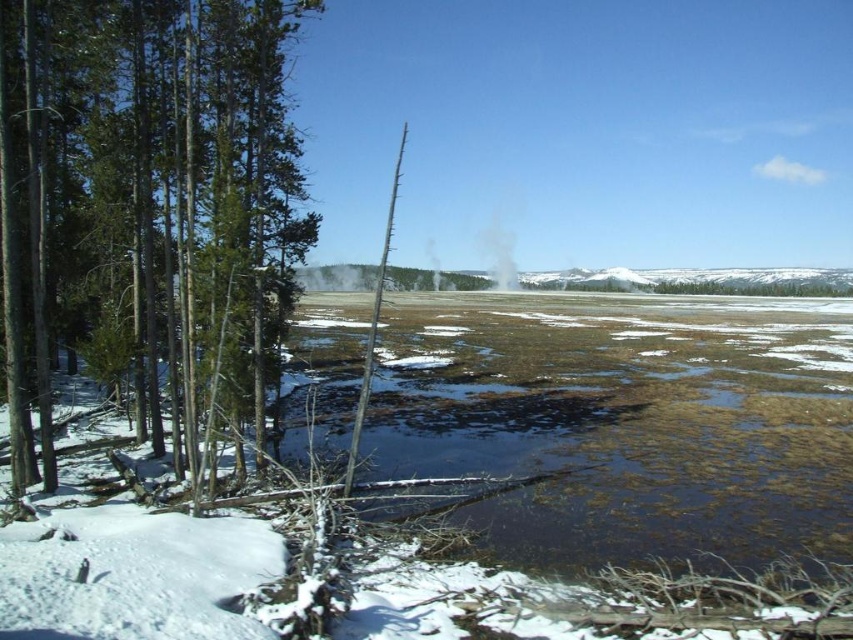
You are an explorer in the winter landscape. You want to walk from the green matte tree at left to the white translucent steam at center. Which direction should you move relative to your current position?

You should move towards the center of the image away from the green matte tree at left, since the white translucent steam at center is farther away than the green matte tree at left.

You are standing at the point labeled point (492,284) and want to walk towards the point labeled point (790,323). Which direction should you move to get closer to your destination?

You should move forward because point (790,323) is closer to the viewer than point (492,284), so moving towards it would mean walking in the direction of the point that is nearer to you.

You are a hiker trying to cross the open field. You see the green matte tree at left and the brown murky water at center. Which object is closer to you as you approach the field?

The brown murky water at center is closer to you because the green matte tree at left is behind it.